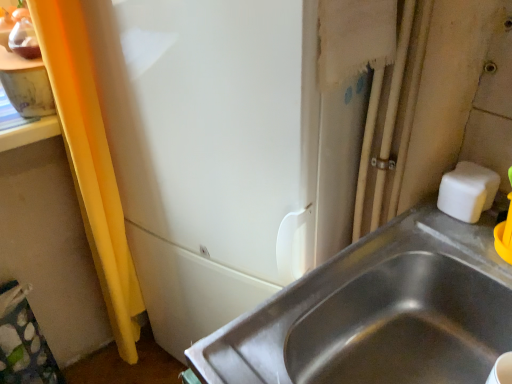
The image size is (512, 384). What are the coordinates of `vacant area in front of white matte soap at upper right` in the screenshot? It's located at (478, 245).